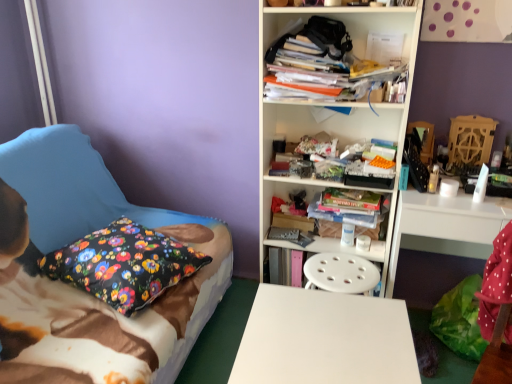
Locate an element on the screen. free space above white smooth desk at center (from a real-world perspective) is located at coordinates [x=327, y=333].